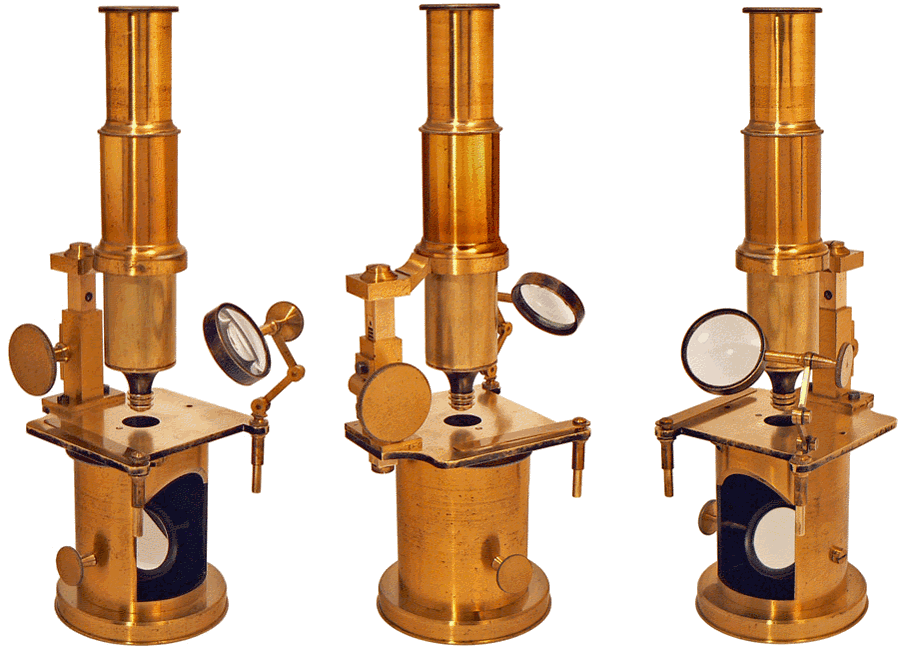
Find the location of `dial/knob`. dial/knob is located at coordinates (706, 526), (507, 571), (68, 572), (38, 368), (392, 411), (841, 366), (292, 322).